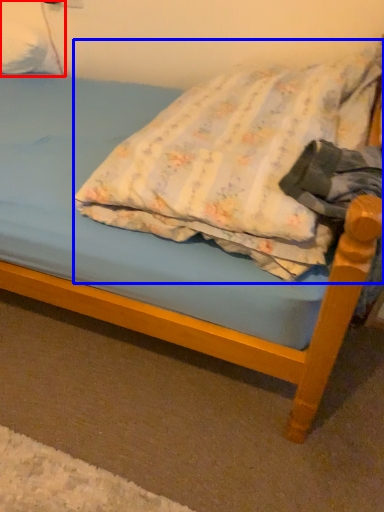
Question: Among these objects, which one is nearest to the camera, pillow (highlighted by a red box) or pillow (highlighted by a blue box)?

Choices:
 (A) pillow
 (B) pillow

Answer: (B)